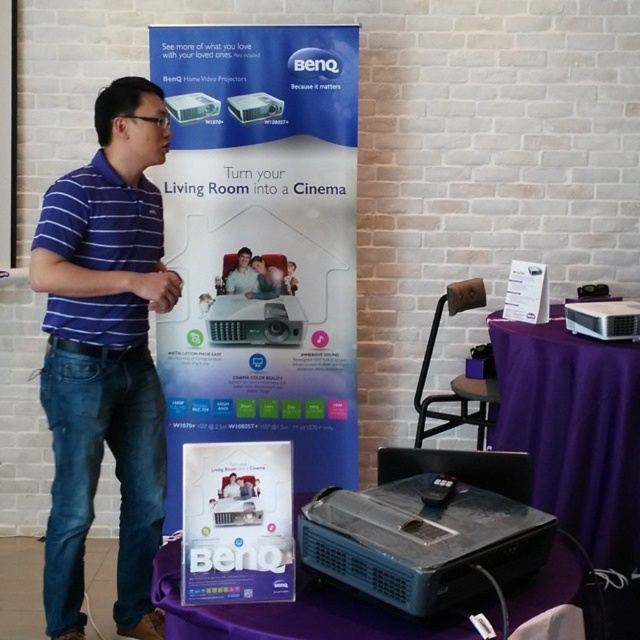
You are organizing a movie night and have a limited space on your table. You need to place both the matte white shirt at center and the black plastic game controller at lower center on the table. Which object should you place first to ensure both fit?

The matte white shirt at center has a larger width than the black plastic game controller at lower center, so you should place the matte white shirt at center first to accommodate its size before placing the smaller black plastic game controller at lower center.

From the picture: You are setting up a home theater and need to position the white glossy poster at center and the matte black projector at center. According to the scene, which object is positioned to the left?

The white glossy poster at center is positioned to the left of the matte black projector at center.